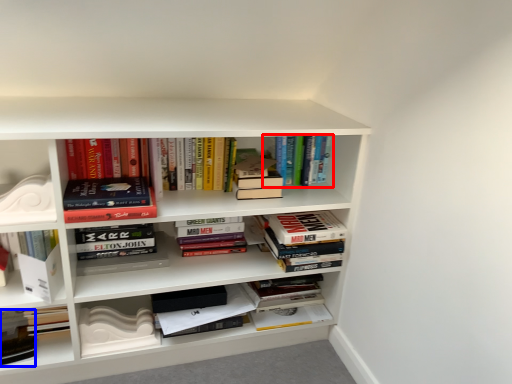
Question: Which object appears closest to the camera in this image, book (highlighted by a red box) or book (highlighted by a blue box)?

Choices:
 (A) book
 (B) book

Answer: (B)